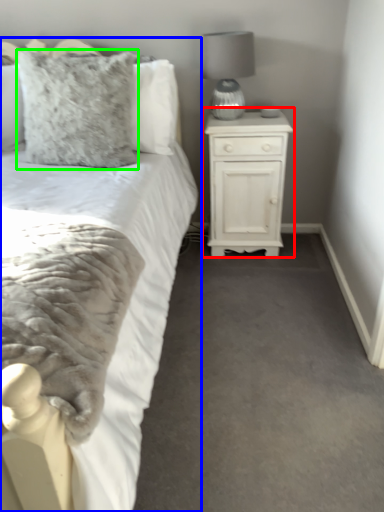
Question: Considering the real-world distances, which object is farthest from nightstand (highlighted by a red box)? bed (highlighted by a blue box) or pillow (highlighted by a green box)?

Choices:
 (A) bed
 (B) pillow

Answer: (A)